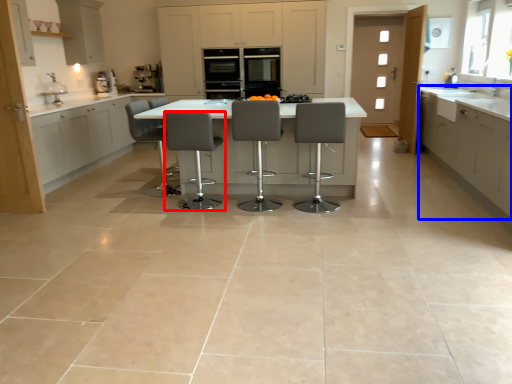
Question: Among these objects, which one is farthest to the camera, chair (highlighted by a red box) or cabinetry (highlighted by a blue box)?

Choices:
 (A) chair
 (B) cabinetry

Answer: (A)